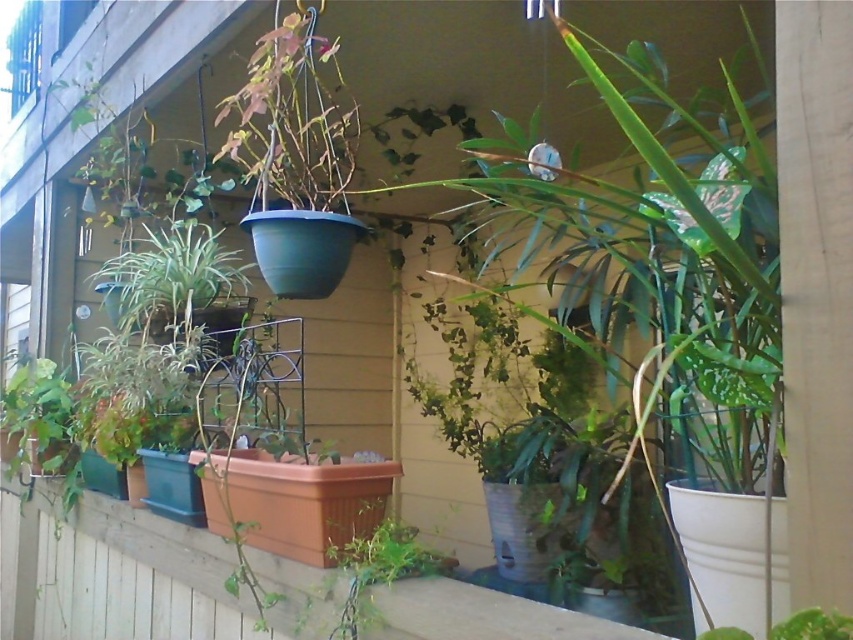
Question: Is green matte plant at left above green leafy plant at lower center?

Choices:
 (A) no
 (B) yes

Answer: (B)

Question: Which of these objects is positioned farthest from the green matte hanging planter at upper center?

Choices:
 (A) green leafy plant at lower center
 (B) green matte plant at left

Answer: (A)

Question: Among these points, which one is nearest to the camera?

Choices:
 (A) (351, 582)
 (B) (129, 308)
 (C) (343, 496)

Answer: (A)

Question: Where is green matte plant at left located in relation to green leafy plant at lower center in the image?

Choices:
 (A) below
 (B) above

Answer: (B)

Question: Which point appears closest to the camera in this image?

Choices:
 (A) (398, 534)
 (B) (293, 509)

Answer: (A)

Question: Can you confirm if green matte hanging planter at upper center is wider than green leafy plant at lower center?

Choices:
 (A) yes
 (B) no

Answer: (A)